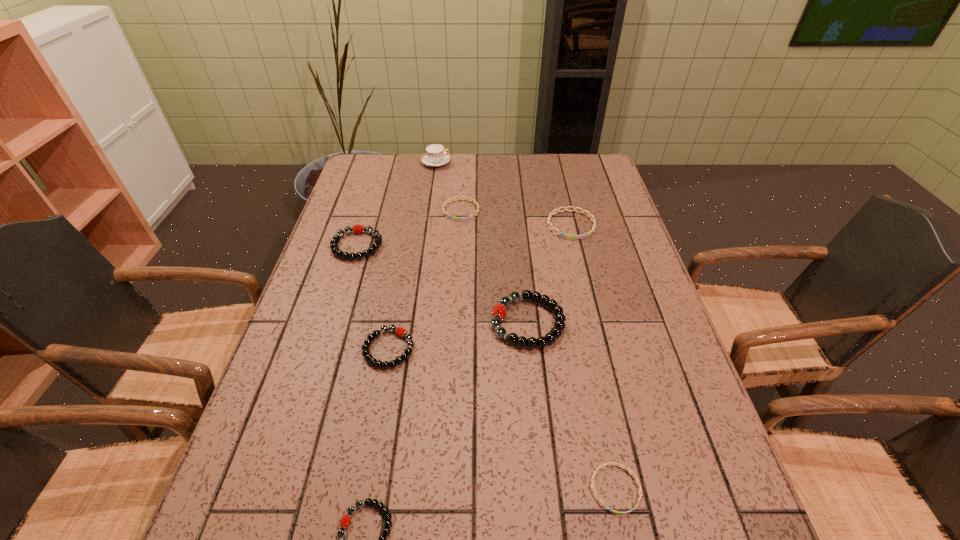
You are a GUI agent. You are given a task and a screenshot of the screen. Output one action in this format:
    pyautogui.click(x=<x>, y=<y>)
    Task: Click on the teacup
    
    Given the screenshot: What is the action you would take?
    pyautogui.click(x=435, y=155)

You are a GUI agent. You are given a task and a screenshot of the screen. Output one action in this format:
    pyautogui.click(x=<x>, y=<y>)
    Task: Click on the tallest object
    
    Given the screenshot: What is the action you would take?
    pyautogui.click(x=435, y=155)

Locate an element on the screen. The image size is (960, 540). the biggest black bracelet is located at coordinates (559, 325).

At what (x,y) coordinates should I click in order to perform the action: click on the seventh shortest object. Please return your answer as a coordinate pair (x, y). Looking at the image, I should click on (559, 325).

This screenshot has height=540, width=960. In order to click on the leftmost object in this screenshot , I will do `click(358, 229)`.

Identify the location of the farthest black bracelet. (358, 229).

Identify the location of the biggest blue bracelet. (568, 236).

Where is `the third biggest black bracelet`? This screenshot has height=540, width=960. the third biggest black bracelet is located at coordinates (401, 332).

Where is `the leftmost blue bracelet`? The image size is (960, 540). the leftmost blue bracelet is located at coordinates (465, 198).

Image resolution: width=960 pixels, height=540 pixels. I want to click on the fourth bracelet from right to left, so click(465, 198).